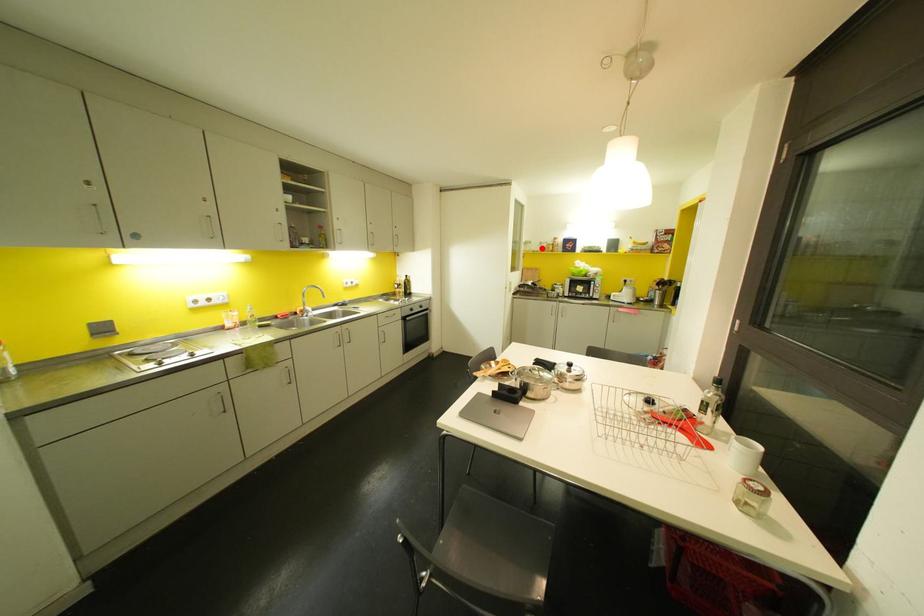
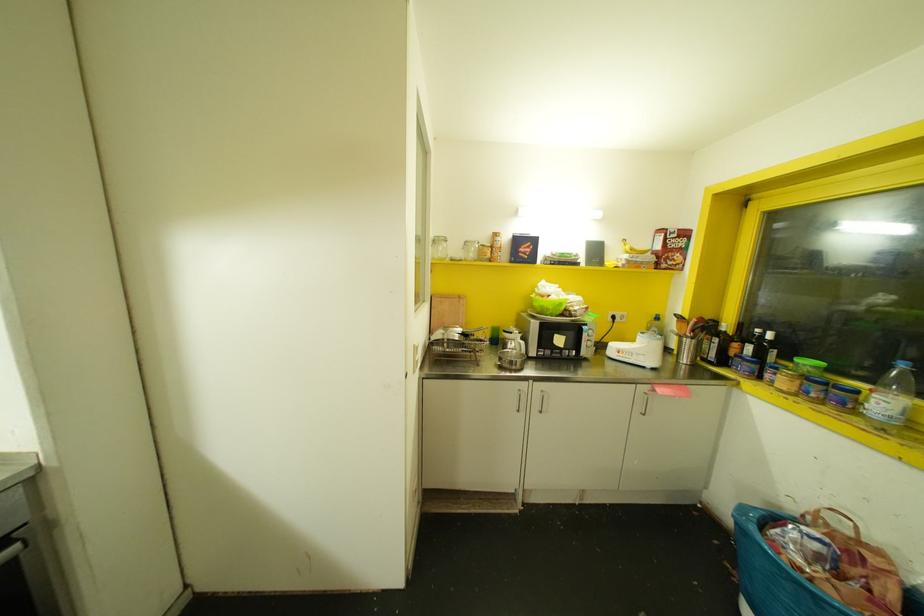
In the second image, find the point that corresponds to the highlighted location in the first image.

(470, 254)